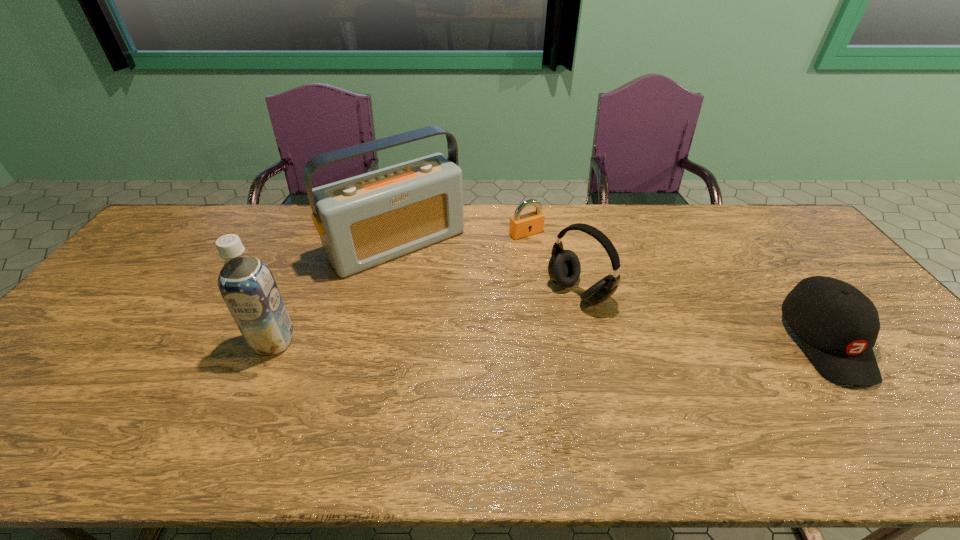
Where is `vacant space at the far edge of the desktop`? vacant space at the far edge of the desktop is located at coordinates (490, 234).

Locate an element on the screen. Image resolution: width=960 pixels, height=540 pixels. vacant space at the near edge is located at coordinates point(747,386).

Image resolution: width=960 pixels, height=540 pixels. I want to click on blank space at the far left corner of the desktop, so click(x=205, y=207).

Locate an element on the screen. free space at the far right corner is located at coordinates (790, 227).

The height and width of the screenshot is (540, 960). Find the location of `free space between the radio receiver and the headset`. free space between the radio receiver and the headset is located at coordinates (489, 268).

Identify the location of free area in between the radio receiver and the third tallest object. This screenshot has height=540, width=960. (489, 268).

Locate an element on the screen. free space between the baseball cap and the soya milk is located at coordinates (549, 341).

In order to click on empty location between the soya milk and the padlock in this screenshot , I will do `click(400, 287)`.

Identify the location of free space between the radio receiver and the padlock. This screenshot has height=540, width=960. (462, 239).

This screenshot has width=960, height=540. I want to click on vacant space in between the rightmost object and the soya milk, so click(549, 341).